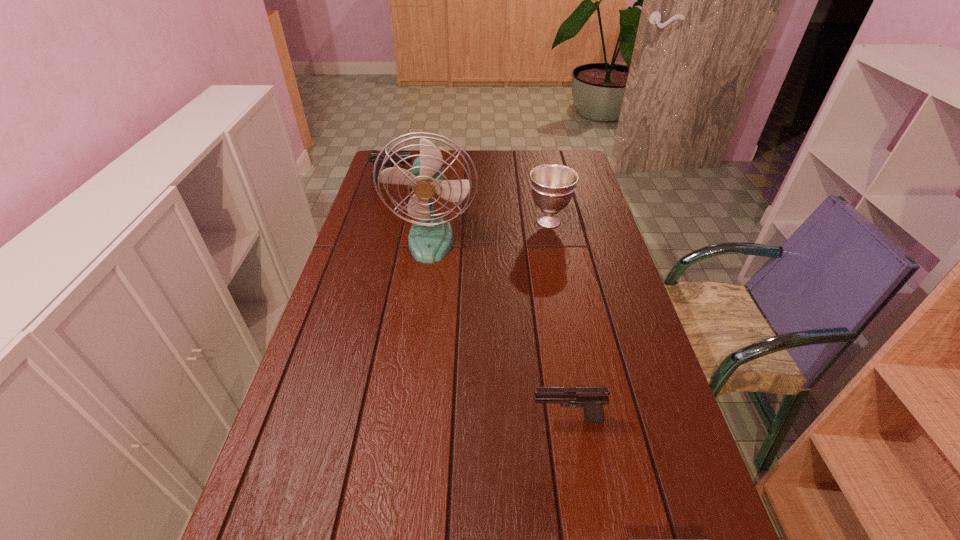
Locate an element on the screen. fan is located at coordinates (430, 238).

Image resolution: width=960 pixels, height=540 pixels. What are the coordinates of `the fourth shortest object` in the screenshot? It's located at (552, 185).

Where is `the leftmost pistol`? the leftmost pistol is located at coordinates (373, 156).

Locate an element on the screen. The image size is (960, 540). the farthest pistol is located at coordinates (373, 156).

At what (x,y) coordinates should I click in order to perform the action: click on the fourth farthest object. Please return your answer as a coordinate pair (x, y). Looking at the image, I should click on (592, 399).

The image size is (960, 540). In order to click on vacant region located in front of the fan, directing airflow in this screenshot , I will do `click(419, 332)`.

Locate an element on the screen. The height and width of the screenshot is (540, 960). free space located 0.080m on the left of the fourth shortest object is located at coordinates (503, 221).

The height and width of the screenshot is (540, 960). I want to click on vacant space located 0.160m at the barrel of the leftmost pistol, so click(455, 180).

Find the location of a particular element. free spot located 0.180m aim along the barrel of the second farthest pistol is located at coordinates (450, 420).

Locate an element on the screen. The height and width of the screenshot is (540, 960). vacant region located 0.110m aim along the barrel of the second farthest pistol is located at coordinates click(482, 420).